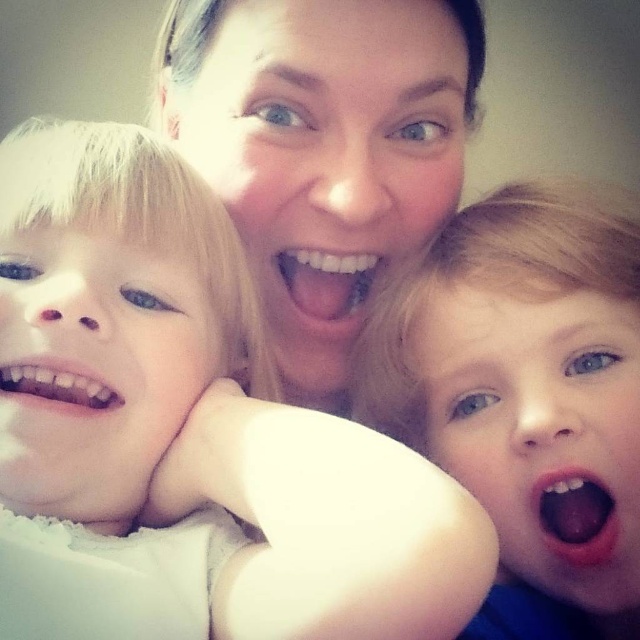
Question: Which is nearer to the smooth skin face at center?

Choices:
 (A) white glossy teeth at center
 (B) blonde hair at right

Answer: (A)

Question: Which object is farther from the camera taking this photo?

Choices:
 (A) white glossy teeth at lower left
 (B) white soft baby at center

Answer: (A)

Question: Is blonde hair at right thinner than smooth skin face at center?

Choices:
 (A) yes
 (B) no

Answer: (A)

Question: Does white soft baby at center appear over white glossy teeth at center?

Choices:
 (A) yes
 (B) no

Answer: (B)

Question: Is the position of blonde hair at right less distant than that of pink glossy lips at center?

Choices:
 (A) no
 (B) yes

Answer: (B)

Question: Which point is closer to the camera?

Choices:
 (A) (589, 209)
 (B) (612, 538)
 (C) (362, 280)
 (D) (61, 378)

Answer: (D)